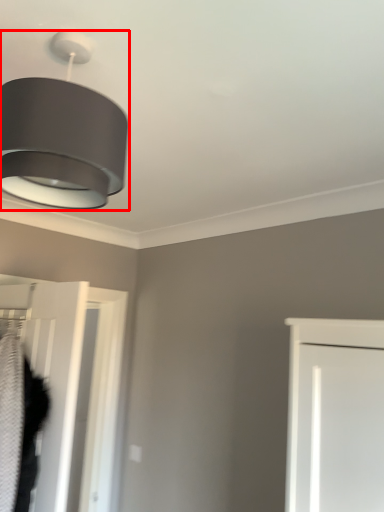
Question: Where is lamp (annotated by the red box) located in relation to door in the image?

Choices:
 (A) right
 (B) left

Answer: (A)